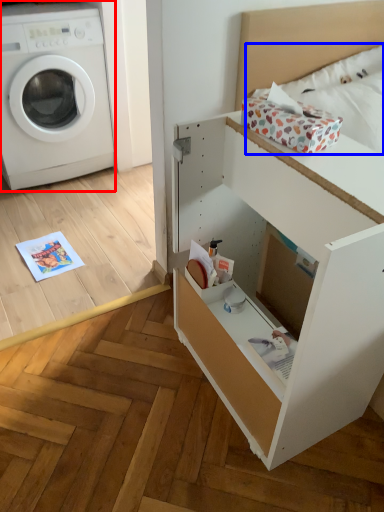
Question: Which point is closer to the camera, washing machine (highlighted by a red box) or bedding (highlighted by a blue box)?

Choices:
 (A) washing machine
 (B) bedding

Answer: (B)